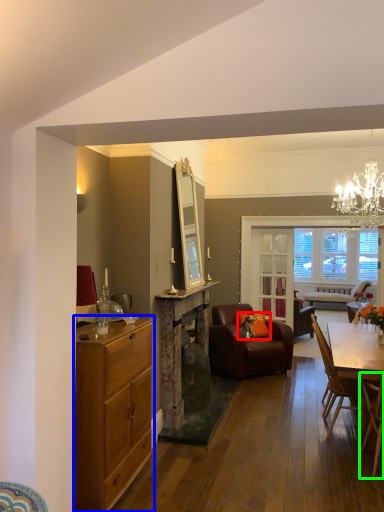
Question: Which object is the farthest from pillow (highlighted by a red box)? Choose among these: cabinetry (highlighted by a blue box) or chair (highlighted by a green box).

Choices:
 (A) cabinetry
 (B) chair

Answer: (A)